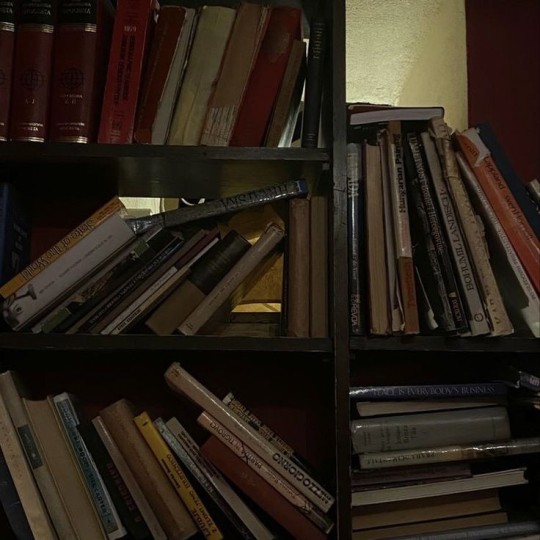
Where is `bottom left book shelf`? The image size is (540, 540). bottom left book shelf is located at coordinates (140, 396).